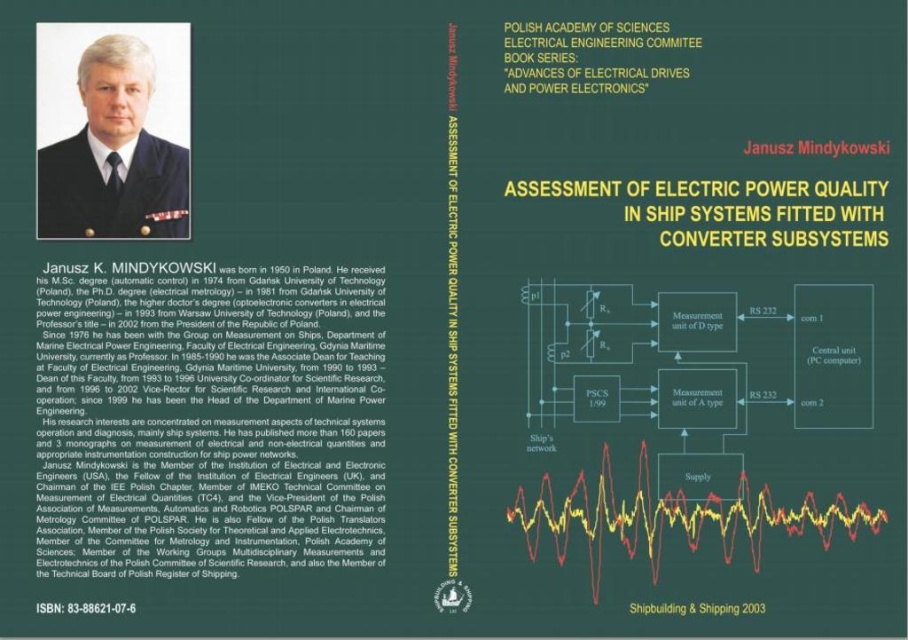
Question: Based on their relative distances, which object is nearer to the matte black uniform at upper left?

Choices:
 (A) yellow text at upper center
 (B) green paper at upper center
 (C) white paper at upper center

Answer: (C)

Question: In this image, where is matte black uniform at upper left located relative to white paper at upper center?

Choices:
 (A) right
 (B) left

Answer: (B)

Question: Which point is closer to the camera?

Choices:
 (A) yellow text at upper center
 (B) green paper at upper center

Answer: (B)

Question: Considering the real-world distances, which object is closest to the yellow text at upper center?

Choices:
 (A) green paper at upper center
 (B) white paper at upper center

Answer: (B)

Question: Does matte black uniform at upper left have a larger size compared to green paper at upper center?

Choices:
 (A) no
 (B) yes

Answer: (B)

Question: Does matte black uniform at upper left have a greater width compared to yellow text at upper center?

Choices:
 (A) no
 (B) yes

Answer: (A)